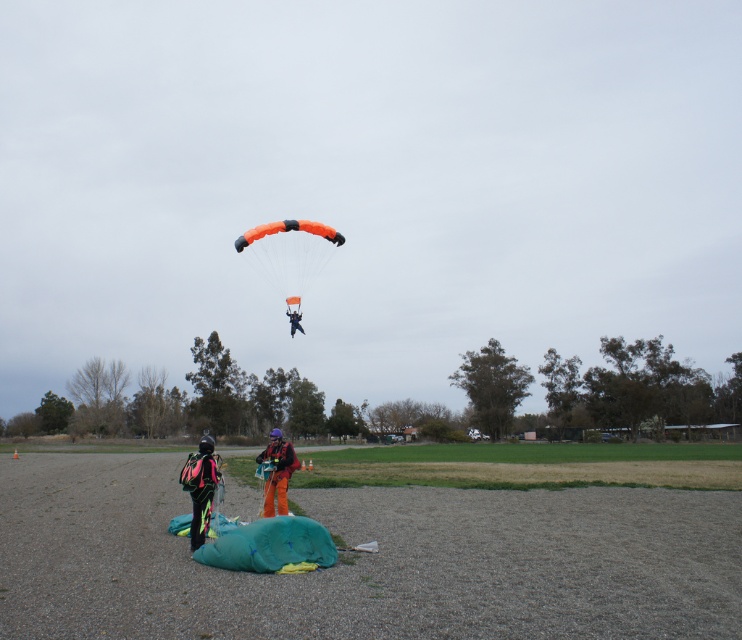
Between orange fabric parachute at center and orange fabric parachute at upper center, which one has more height?

orange fabric parachute at center is taller.

Between orange fabric parachute at center and orange fabric parachute at upper center, which one is positioned higher?

Positioned higher is orange fabric parachute at upper center.

Between point (275, 476) and point (292, 316), which one is positioned behind?

The point (292, 316) is more distant.

Find the location of a particular element. orange fabric parachute at center is located at coordinates (278, 472).

Does point (188, 483) come farther from viewer compared to point (288, 312)?

No, it is in front of (288, 312).

Does neon yellow fabric wingsuit at lower left have a greater width compared to orange fabric parachute at upper center?

Indeed, neon yellow fabric wingsuit at lower left has a greater width compared to orange fabric parachute at upper center.

Which is behind, point (211, 461) or point (298, 310)?

The point (298, 310) is more distant.

You are a GUI agent. You are given a task and a screenshot of the screen. Output one action in this format:
    pyautogui.click(x=<x>, y=<y>)
    Task: Click on the neon yellow fabric wingsuit at lower left
    Image resolution: width=742 pixels, height=640 pixels.
    Given the screenshot: What is the action you would take?
    pyautogui.click(x=200, y=486)

Is orange matte parachute at center thinner than neon yellow fabric wingsuit at lower left?

No, orange matte parachute at center is not thinner than neon yellow fabric wingsuit at lower left.

Can you confirm if orange matte parachute at center is positioned below neon yellow fabric wingsuit at lower left?

No, orange matte parachute at center is not below neon yellow fabric wingsuit at lower left.

Identify the location of orange matte parachute at center. pyautogui.click(x=289, y=252).

This screenshot has width=742, height=640. Identify the location of orange matte parachute at center. (289, 252).